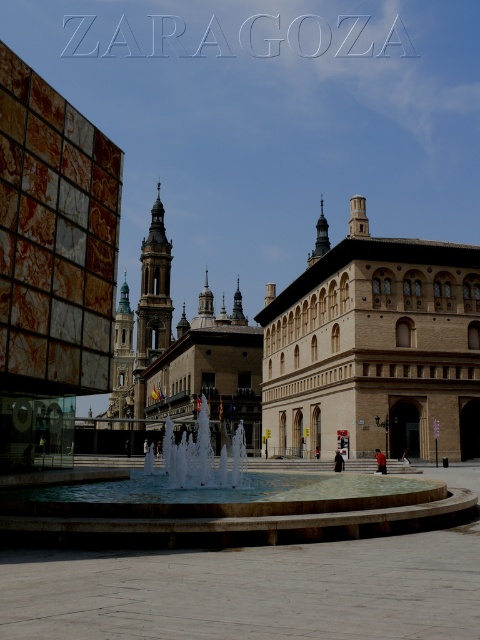
Question: Is white marble fountain at center closer to the viewer compared to white glossy fountain at center?

Choices:
 (A) no
 (B) yes

Answer: (B)

Question: Which point is farther to the camera?

Choices:
 (A) (148, 465)
 (B) (350, 227)

Answer: (B)

Question: Which point is closer to the camera?

Choices:
 (A) (181, 483)
 (B) (171, 460)

Answer: (A)

Question: Is beige stone building at center below white glossy fountain at center?

Choices:
 (A) no
 (B) yes

Answer: (A)

Question: Is beige stone building at center below white glossy fountain at center?

Choices:
 (A) no
 (B) yes

Answer: (A)

Question: Which point is closer to the camera taking this photo?

Choices:
 (A) (387, 256)
 (B) (190, 470)
 (C) (450, 499)

Answer: (C)